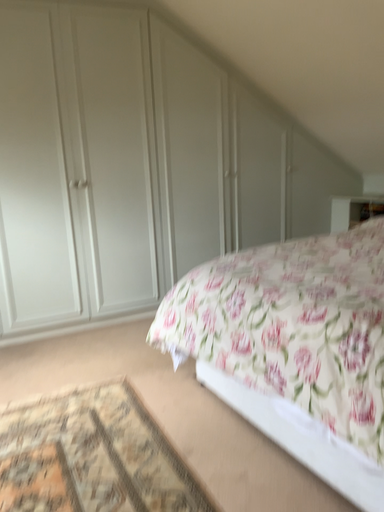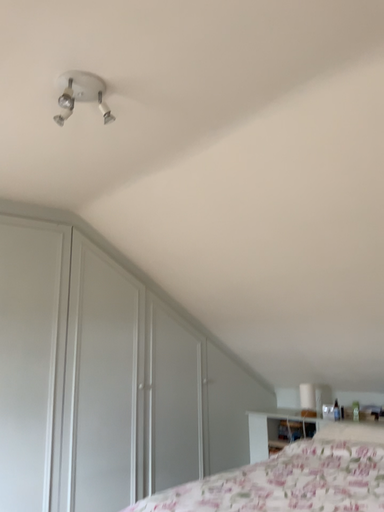
Question: Which way did the camera rotate in the video?

Choices:
 (A) rotated downward
 (B) rotated upward

Answer: (B)